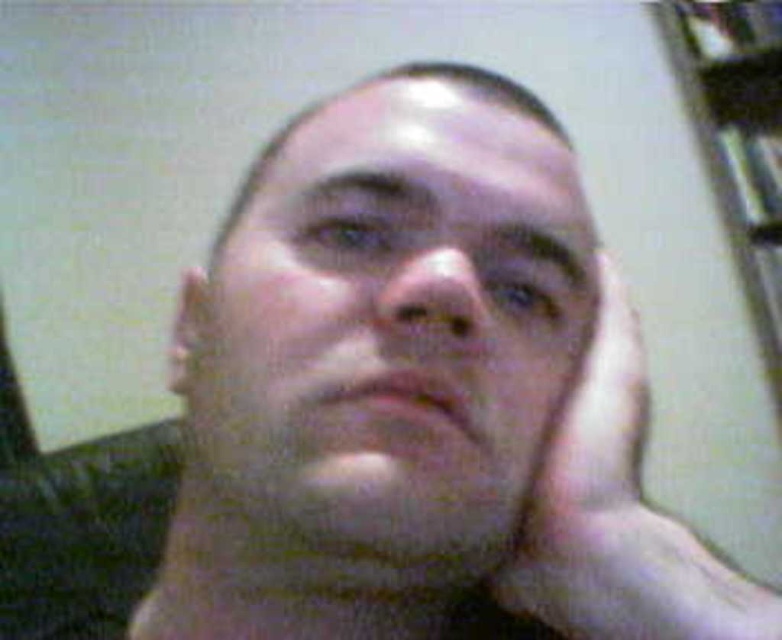
Question: Is smooth skin face at center to the right of white matte hand at center from the viewer's perspective?

Choices:
 (A) yes
 (B) no

Answer: (B)

Question: Does smooth skin face at center appear on the left side of white matte hand at center?

Choices:
 (A) no
 (B) yes

Answer: (B)

Question: Considering the relative positions of smooth skin face at center and white matte hand at center in the image provided, where is smooth skin face at center located with respect to white matte hand at center?

Choices:
 (A) below
 (B) above

Answer: (B)

Question: Which point is farther from the camera taking this photo?

Choices:
 (A) (580, 385)
 (B) (332, 317)

Answer: (A)

Question: Which point is closer to the camera taking this photo?

Choices:
 (A) (608, 458)
 (B) (381, 220)

Answer: (B)